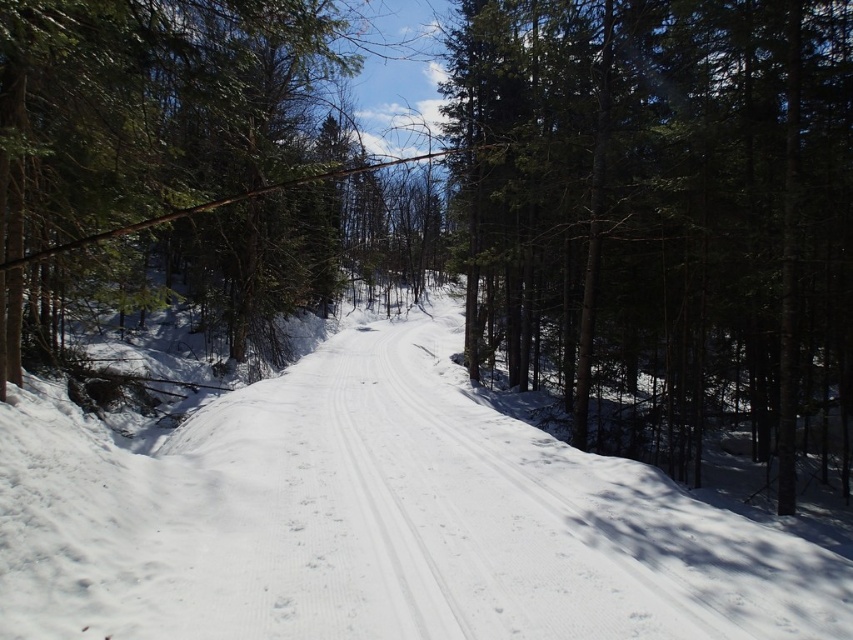
Question: Considering the relative positions of white powdery snow at center and green textured tree at center in the image provided, where is white powdery snow at center located with respect to green textured tree at center?

Choices:
 (A) left
 (B) right

Answer: (A)

Question: Which of the following is the closest to the observer?

Choices:
 (A) green textured tree at center
 (B) white powdery snow at center

Answer: (B)

Question: Which point is farther to the camera?

Choices:
 (A) (468, 392)
 (B) (546, 33)

Answer: (A)

Question: Does white powdery snow at center appear over green textured tree at center?

Choices:
 (A) yes
 (B) no

Answer: (B)

Question: Where is white powdery snow at center located in relation to green textured tree at center in the image?

Choices:
 (A) right
 (B) left

Answer: (B)